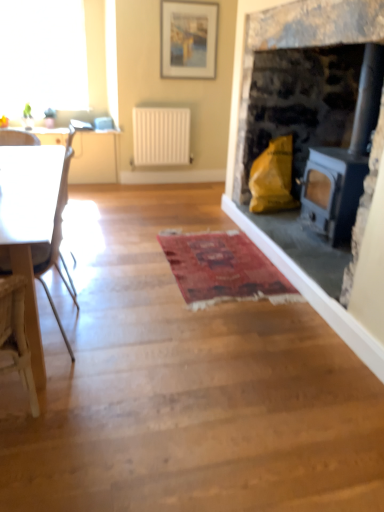
Find the location of a particular element. Image resolution: width=384 pixels, height=512 pixels. matte white picture frame at upper center is located at coordinates (188, 39).

Describe the element at coordinates (161, 136) in the screenshot. The height and width of the screenshot is (512, 384). I see `white matte radiator at center` at that location.

What is the approximate height of white matte radiator at center?

The height of white matte radiator at center is 27.45 inches.

Describe the element at coordinates (42, 56) in the screenshot. The width and height of the screenshot is (384, 512). I see `transparent glass window at upper left` at that location.

The width and height of the screenshot is (384, 512). In order to click on white glossy table at left in this screenshot , I will do `click(92, 155)`.

Identify the location of white plastic chair at left. (56, 250).

This screenshot has width=384, height=512. What do you see at coordinates (56, 250) in the screenshot? I see `white plastic chair at left` at bounding box center [56, 250].

The width and height of the screenshot is (384, 512). In order to click on matte white picture frame at upper center in this screenshot , I will do `click(188, 39)`.

Find the location of a particular element. The height and width of the screenshot is (512, 384). window above the white matte radiator at center (from a real-world perspective) is located at coordinates (42, 56).

In the scene shown: From the image's perspective, which one is positioned higher, transparent glass window at upper left or white matte radiator at center?

transparent glass window at upper left.

In the scene shown: Which object is thinner, transparent glass window at upper left or white matte radiator at center?

With smaller width is white matte radiator at center.

Is transparent glass window at upper left situated inside white matte radiator at center or outside?

transparent glass window at upper left lies outside white matte radiator at center.

How different are the orientations of matte white picture frame at upper center and transparent glass window at upper left in degrees?

The angular difference between matte white picture frame at upper center and transparent glass window at upper left is 0.623 degrees.

Is matte white picture frame at upper center oriented away from transparent glass window at upper left?

matte white picture frame at upper center is not turned away from transparent glass window at upper left.

Are matte white picture frame at upper center and transparent glass window at upper left located far from each other?

Absolutely, matte white picture frame at upper center is distant from transparent glass window at upper left.

Is matte white picture frame at upper center spatially inside transparent glass window at upper left, or outside of it?

matte white picture frame at upper center is located beyond the bounds of transparent glass window at upper left.

Looking at this image, is white plastic chair at left next to white glossy countertop at upper left and touching it?

No.

Is white plastic chair at left positioned in front of white glossy countertop at upper left?

Yes, white plastic chair at left is closer to the camera.

Could you tell me if white plastic chair at left is turned towards white glossy countertop at upper left?

No, white plastic chair at left is not aimed at white glossy countertop at upper left.

Is white plastic chair at left taller than white glossy countertop at upper left?

Yes, white plastic chair at left is taller than white glossy countertop at upper left.

Does point (210, 20) lie behind point (86, 132)?

That is True.

From the image's perspective, which one is positioned lower, matte white picture frame at upper center or white glossy countertop at upper left?

white glossy countertop at upper left.

Which of these two, matte white picture frame at upper center or white glossy countertop at upper left, stands taller?

With more height is matte white picture frame at upper center.

From the image's perspective, between matte stone fireplace at right and matte white picture frame at upper center, which one is located above?

matte white picture frame at upper center is shown above in the image.

Is matte stone fireplace at right positioned far away from matte white picture frame at upper center?

Yes, matte stone fireplace at right and matte white picture frame at upper center are quite far apart.

Consider the image. Between matte stone fireplace at right and matte white picture frame at upper center, which one has larger size?

matte stone fireplace at right.

Which is behind, point (380, 305) or point (179, 31)?

The point (179, 31) is farther from the camera.

Based on the photo, is white glossy table at left positioned beyond the bounds of white glossy countertop at upper left?

white glossy table at left lies outside white glossy countertop at upper left's area.

Which object is closer to the camera, white glossy table at left or white glossy countertop at upper left?

white glossy countertop at upper left is more forward.

Are white glossy table at left and white glossy countertop at upper left far apart?

That's not correct — white glossy table at left is a little close to white glossy countertop at upper left.

Is white glossy countertop at upper left at the back of white glossy table at left?

No, white glossy table at left is not facing away from white glossy countertop at upper left.

Consider the image. Is white plastic chair at left bigger than matte stone fireplace at right?

Incorrect, white plastic chair at left is not larger than matte stone fireplace at right.

Does white plastic chair at left turn towards matte stone fireplace at right?

No, white plastic chair at left is not facing towards matte stone fireplace at right.

In the scene shown: Does white plastic chair at left appear on the left side of matte stone fireplace at right?

Yes, white plastic chair at left is to the left of matte stone fireplace at right.

From a real-world perspective, who is located higher, white plastic chair at left or matte stone fireplace at right?

matte stone fireplace at right.

What are the coordinates of `radiator directly beneath the transparent glass window at upper left (from a real-world perspective)` in the screenshot? It's located at (161, 136).

What are the coordinates of `window on the left of matte white picture frame at upper center` in the screenshot? It's located at (42, 56).

When comparing their distances from transparent glass window at upper left, does matte stone fireplace at right or matte white picture frame at upper center seem further?

matte stone fireplace at right lies further to transparent glass window at upper left than the other object.

From the image, which object appears to be farther from white glossy countertop at upper left, white matte radiator at center or matte white picture frame at upper center?

Among the two, matte white picture frame at upper center is located further to white glossy countertop at upper left.

Estimate the real-world distances between objects in this image. Which object is closer to white plastic chair at left, transparent glass window at upper left or matte white picture frame at upper center?

matte white picture frame at upper center is positioned closer to the anchor white plastic chair at left.

Which object lies further to the anchor point matte white picture frame at upper center, white plastic chair at left or transparent glass window at upper left?

white plastic chair at left is further to matte white picture frame at upper center.

Estimate the real-world distances between objects in this image. Which object is further from white glossy table at left, matte stone fireplace at right or white plastic chair at left?

Based on the image, white plastic chair at left appears to be further to white glossy table at left.

Looking at the image, which one is located further to matte white picture frame at upper center, white plastic chair at left or white matte radiator at center?

Based on the image, white plastic chair at left appears to be further to matte white picture frame at upper center.

When comparing their distances from white glossy countertop at upper left, does white plastic chair at left or white matte radiator at center seem closer?

Based on the image, white matte radiator at center appears to be nearer to white glossy countertop at upper left.

Looking at the image, which one is located closer to white matte radiator at center, white glossy table at left or matte stone fireplace at right?

white glossy table at left.

This screenshot has width=384, height=512. What are the coordinates of `counter top between white plastic chair at left and white matte radiator at center in the front-back direction` in the screenshot? It's located at (41, 130).

Where is `picture frame between matte stone fireplace at right and white matte radiator at center from front to back`? The width and height of the screenshot is (384, 512). picture frame between matte stone fireplace at right and white matte radiator at center from front to back is located at coordinates (188, 39).

This screenshot has height=512, width=384. I want to click on fireplace between white plastic chair at left and white matte radiator at center from front to back, so click(290, 258).

You are a GUI agent. You are given a task and a screenshot of the screen. Output one action in this format:
    pyautogui.click(x=<x>, y=<y>)
    Task: Click on the table between white glossy countertop at upper left and white matte radiator at center in the horizontal direction
    This screenshot has height=512, width=384.
    Given the screenshot: What is the action you would take?
    pyautogui.click(x=92, y=155)